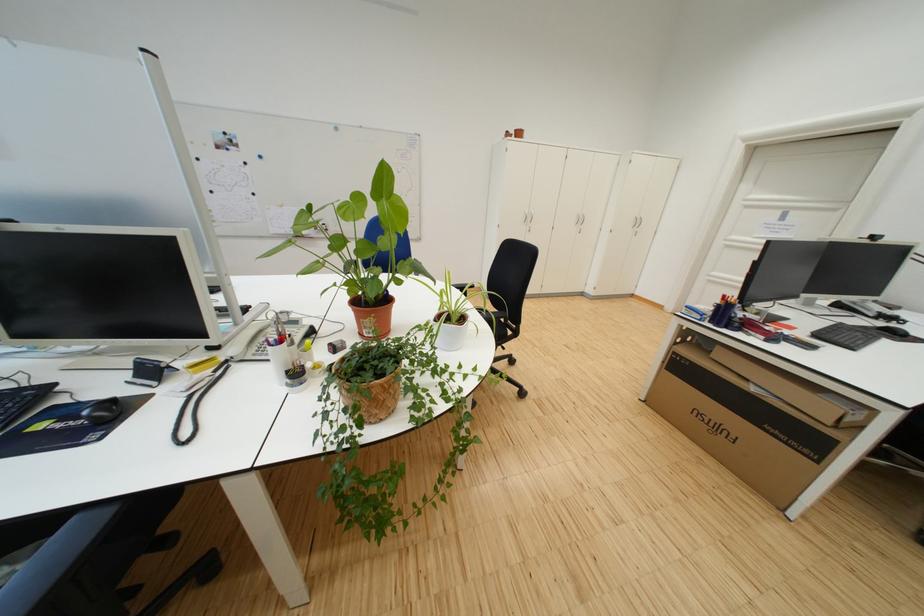
The location [286,357] corresponds to which object?

It refers to a white pen holder.